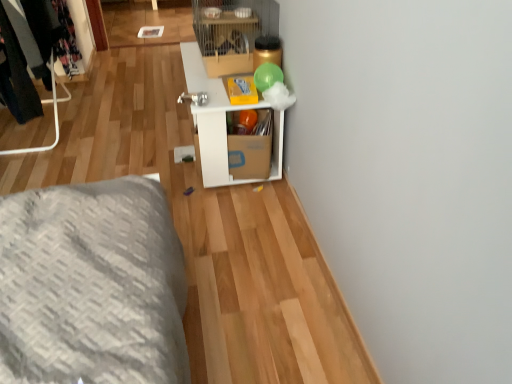
This screenshot has height=384, width=512. Find the location of `metal clothing rack at left`. metal clothing rack at left is located at coordinates click(x=54, y=115).

What do you see at coordinates (54, 115) in the screenshot? This screenshot has width=512, height=384. I see `metal clothing rack at left` at bounding box center [54, 115].

Locate an element on the screen. The height and width of the screenshot is (384, 512). white cardboard shelf at center is located at coordinates (212, 120).

What do you see at coordinates (212, 120) in the screenshot?
I see `white cardboard shelf at center` at bounding box center [212, 120].

Measure the distance between white cardboard shelf at center and camera.

A distance of 5.32 feet exists between white cardboard shelf at center and camera.

Locate an element on the screen. Image resolution: width=512 pixels, height=384 pixels. metal clothing rack at left is located at coordinates pos(54,115).

Is metal clothing rack at left to the left or to the right of white cardboard shelf at center in the image?

metal clothing rack at left is positioned on white cardboard shelf at center's left side.

Is metal clothing rack at left in front of white cardboard shelf at center?

No.

Does point (24, 148) appear closer or farther from the camera than point (272, 154)?

Point (24, 148) is positioned farther from the camera compared to point (272, 154).

From the image's perspective, would you say metal clothing rack at left is positioned over white cardboard shelf at center?

Correct, metal clothing rack at left appears higher than white cardboard shelf at center in the image.

From a real-world perspective, who is located higher, metal clothing rack at left or white cardboard shelf at center?

metal clothing rack at left is physically above.

Can you confirm if metal clothing rack at left is wider than white cardboard shelf at center?

No.

Who is shorter, metal clothing rack at left or white cardboard shelf at center?

Standing shorter between the two is white cardboard shelf at center.

Looking at this image, which of these two, metal clothing rack at left or white cardboard shelf at center, is smaller?

metal clothing rack at left.

Would you say metal clothing rack at left is outside white cardboard shelf at center?

Yes.

Is metal clothing rack at left far from white cardboard shelf at center?

No.

Is white cardboard shelf at center at the back of metal clothing rack at left?

That's not correct — metal clothing rack at left is not looking away from white cardboard shelf at center.

What's the angular difference between metal clothing rack at left and white cardboard shelf at center's facing directions?

metal clothing rack at left and white cardboard shelf at center are facing 179 degrees away from each other.

Measure the distance from metal clothing rack at left to white cardboard shelf at center.

The distance of metal clothing rack at left from white cardboard shelf at center is 37.35 inches.

Locate an element on the screen. shelf to the right of metal clothing rack at left is located at coordinates (212, 120).

Is white cardboard shelf at center to the right of metal clothing rack at left from the viewer's perspective?

Yes.

Considering the positions of objects white cardboard shelf at center and metal clothing rack at left in the image provided, who is in front, white cardboard shelf at center or metal clothing rack at left?

white cardboard shelf at center is closer to the camera.

Considering the positions of points (205, 88) and (57, 100), is point (205, 88) farther from camera compared to point (57, 100)?

No, it is in front of (57, 100).

From the image's perspective, is white cardboard shelf at center under metal clothing rack at left?

Yes, from the image's perspective, white cardboard shelf at center is beneath metal clothing rack at left.

Consider the image. From a real-world perspective, who is located lower, white cardboard shelf at center or metal clothing rack at left?

Answer: white cardboard shelf at center is physically lower.

Is white cardboard shelf at center thinner than metal clothing rack at left?

No, white cardboard shelf at center is not thinner than metal clothing rack at left.

Which of these two, white cardboard shelf at center or metal clothing rack at left, stands shorter?

white cardboard shelf at center is shorter.

Does white cardboard shelf at center have a larger size compared to metal clothing rack at left?

Indeed, white cardboard shelf at center has a larger size compared to metal clothing rack at left.

Which is correct: white cardboard shelf at center is inside metal clothing rack at left, or outside of it?

white cardboard shelf at center lies outside metal clothing rack at left.

Consider the image. Would you consider white cardboard shelf at center to be distant from metal clothing rack at left?

Actually, white cardboard shelf at center and metal clothing rack at left are a little close together.

Does white cardboard shelf at center turn towards metal clothing rack at left?

Yes, white cardboard shelf at center is facing metal clothing rack at left.

How many degrees apart are the facing directions of white cardboard shelf at center and metal clothing rack at left?

white cardboard shelf at center and metal clothing rack at left are facing 179 degrees away from each other.

Measure the distance between white cardboard shelf at center and metal clothing rack at left.

white cardboard shelf at center is 94.87 centimeters from metal clothing rack at left.

The image size is (512, 384). In order to click on furniture that appears on the left of white cardboard shelf at center in this screenshot , I will do `click(54, 115)`.

This screenshot has width=512, height=384. I want to click on furniture above the white cardboard shelf at center (from the image's perspective), so click(x=54, y=115).

You are a GUI agent. You are given a task and a screenshot of the screen. Output one action in this format:
    pyautogui.click(x=<x>, y=<y>)
    Task: Click on the furniture on the left of white cardboard shelf at center
    This screenshot has height=384, width=512.
    Given the screenshot: What is the action you would take?
    pyautogui.click(x=54, y=115)